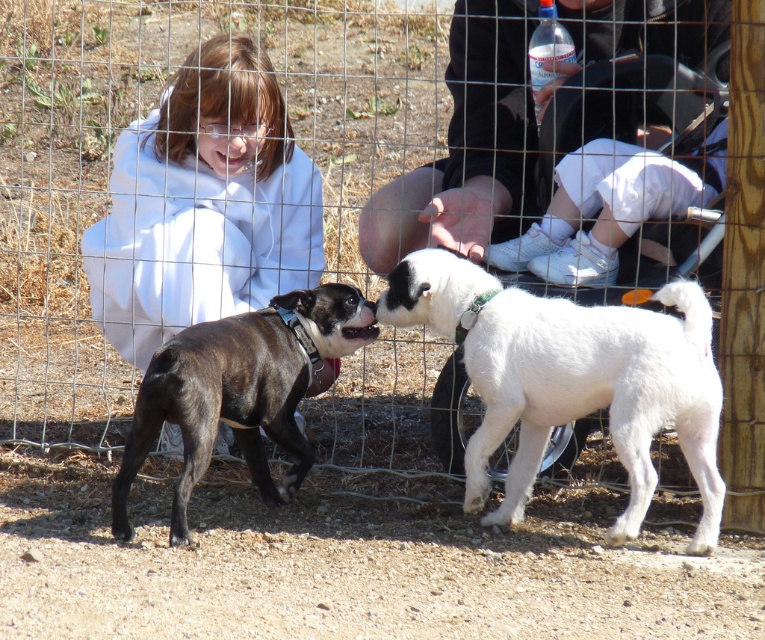
You are a photographer trying to capture a photo of the black brindle dog at center. To ensure the dog is in focus, you need to know its height relative to the white clothed child at left. Can you determine which one is taller?

The white clothed child at left has a greater height compared to the black brindle dog at center, so the child is taller than the dog.

You are a photographer standing in the scene and want to take a photo of the black fabric pants at lower center and the black brindle dog at center. Which object will appear bigger in the photo?

The black fabric pants at lower center will appear bigger in the photo because it is larger in size than the black brindle dog at center.

You are standing in the scene and want to pet the white fluffy dog at center. There are black fabric pants at lower center in your way. Can you walk around them to reach the dog?

The black fabric pants at lower center are closer to you than the white fluffy dog at center, so you can walk around them to reach the dog.